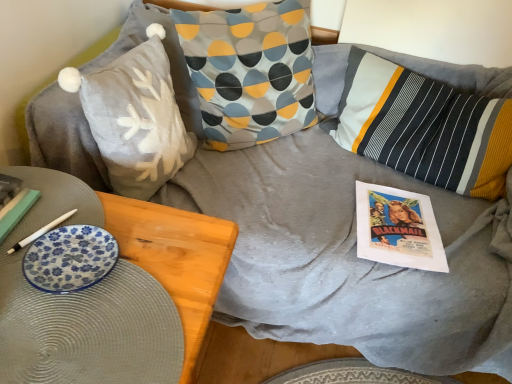
Question: Considering the relative sizes of blue floral plate at lower left and striped cotton pillow at center, the third pillow viewed from the left, in the image provided, is blue floral plate at lower left smaller than striped cotton pillow at center, the third pillow viewed from the left,?

Choices:
 (A) yes
 (B) no

Answer: (A)

Question: Considering the relative sizes of blue floral plate at lower left and striped cotton pillow at center, marked as the 1th pillow in a right-to-left arrangement, in the image provided, is blue floral plate at lower left wider than striped cotton pillow at center, marked as the 1th pillow in a right-to-left arrangement,?

Choices:
 (A) yes
 (B) no

Answer: (B)

Question: Does blue floral plate at lower left appear on the right side of striped cotton pillow at center, marked as the 1th pillow in a right-to-left arrangement?

Choices:
 (A) no
 (B) yes

Answer: (A)

Question: Are blue floral plate at lower left and striped cotton pillow at center, marked as the 1th pillow in a right-to-left arrangement, beside each other?

Choices:
 (A) no
 (B) yes

Answer: (A)

Question: Considering the relative sizes of blue floral plate at lower left and striped cotton pillow at center, the third pillow viewed from the left, in the image provided, is blue floral plate at lower left taller than striped cotton pillow at center, the third pillow viewed from the left,?

Choices:
 (A) yes
 (B) no

Answer: (B)

Question: Considering the positions of blue floral plate at lower left and matte paper comic book at center right in the image, is blue floral plate at lower left wider or thinner than matte paper comic book at center right?

Choices:
 (A) thin
 (B) wide

Answer: (A)

Question: From their relative heights in the image, would you say blue floral plate at lower left is taller or shorter than matte paper comic book at center right?

Choices:
 (A) tall
 (B) short

Answer: (B)

Question: From the image's perspective, relative to matte paper comic book at center right, is blue floral plate at lower left above or below?

Choices:
 (A) below
 (B) above

Answer: (A)

Question: Considering the positions of blue floral plate at lower left and matte paper comic book at center right in the image, is blue floral plate at lower left bigger or smaller than matte paper comic book at center right?

Choices:
 (A) big
 (B) small

Answer: (B)

Question: Is matte paper magazine at lower left in front of or behind patterned fabric pillow at center, which is counted as the 2th pillow, starting from the right, in the image?

Choices:
 (A) behind
 (B) front

Answer: (B)

Question: From the image's perspective, relative to patterned fabric pillow at center, which is counted as the 2th pillow, starting from the right, is matte paper magazine at lower left above or below?

Choices:
 (A) below
 (B) above

Answer: (A)

Question: Is matte paper magazine at lower left bigger or smaller than patterned fabric pillow at center, the 2th pillow from the left?

Choices:
 (A) small
 (B) big

Answer: (A)

Question: Is matte paper magazine at lower left to the left or to the right of patterned fabric pillow at center, the 2th pillow from the left, in the image?

Choices:
 (A) left
 (B) right

Answer: (A)

Question: From a real-world perspective, is patterned fabric pillow at center, the 2th pillow from the left, positioned above or below blue floral plate at lower left?

Choices:
 (A) above
 (B) below

Answer: (B)

Question: In the image, is patterned fabric pillow at center, the 2th pillow from the left, on the left side or the right side of blue floral plate at lower left?

Choices:
 (A) left
 (B) right

Answer: (B)